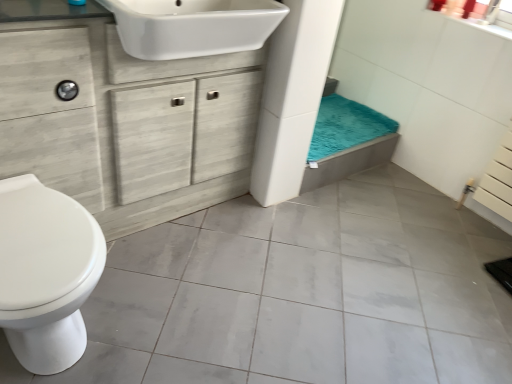
Question: Does white glossy sink at upper center appear on the right side of teal plush bath towel at center?

Choices:
 (A) no
 (B) yes

Answer: (A)

Question: Considering the relative sizes of white glossy sink at upper center and teal plush bath towel at center in the image provided, is white glossy sink at upper center taller than teal plush bath towel at center?

Choices:
 (A) no
 (B) yes

Answer: (B)

Question: Is white glossy sink at upper center not near teal plush bath towel at center?

Choices:
 (A) no
 (B) yes

Answer: (A)

Question: From a real-world perspective, does white glossy sink at upper center stand above teal plush bath towel at center?

Choices:
 (A) yes
 (B) no

Answer: (A)

Question: Does white glossy sink at upper center have a greater width compared to teal plush bath towel at center?

Choices:
 (A) no
 (B) yes

Answer: (A)

Question: From the image's perspective, would you say white glossy sink at upper center is positioned over teal plush bath towel at center?

Choices:
 (A) yes
 (B) no

Answer: (A)

Question: Is white wood cabinet at center shorter than teal plush bath towel at center?

Choices:
 (A) no
 (B) yes

Answer: (A)

Question: Is white wood cabinet at center with teal plush bath towel at center?

Choices:
 (A) yes
 (B) no

Answer: (B)

Question: Is white wood cabinet at center located outside teal plush bath towel at center?

Choices:
 (A) no
 (B) yes

Answer: (B)

Question: Does white wood cabinet at center have a smaller size compared to teal plush bath towel at center?

Choices:
 (A) yes
 (B) no

Answer: (B)

Question: From a real-world perspective, is white wood cabinet at center under teal plush bath towel at center?

Choices:
 (A) no
 (B) yes

Answer: (A)

Question: Can you confirm if white wood cabinet at center is taller than teal plush bath towel at center?

Choices:
 (A) no
 (B) yes

Answer: (B)

Question: Considering the relative positions of white wood cabinet at center and white glossy toilet at left in the image provided, is white wood cabinet at center to the left of white glossy toilet at left from the viewer's perspective?

Choices:
 (A) no
 (B) yes

Answer: (A)